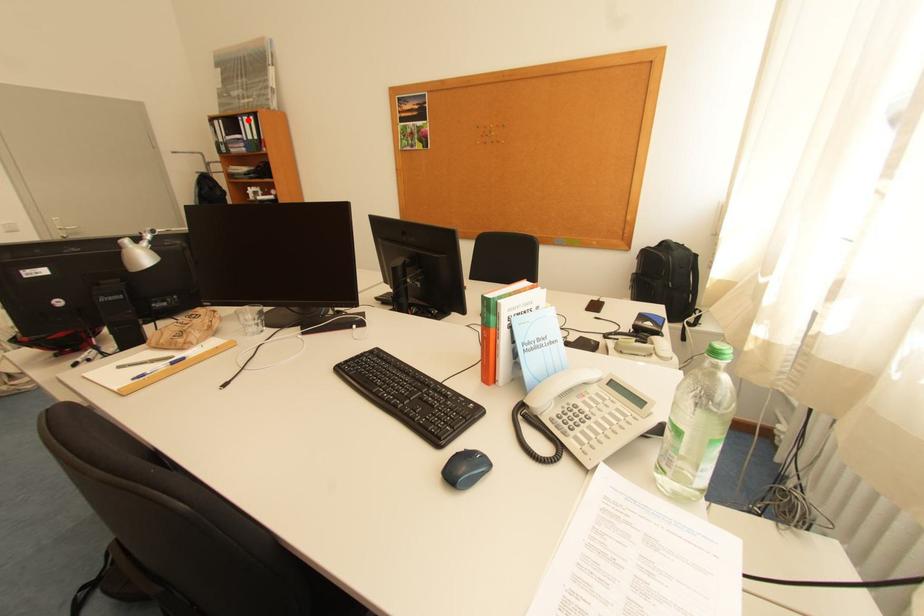
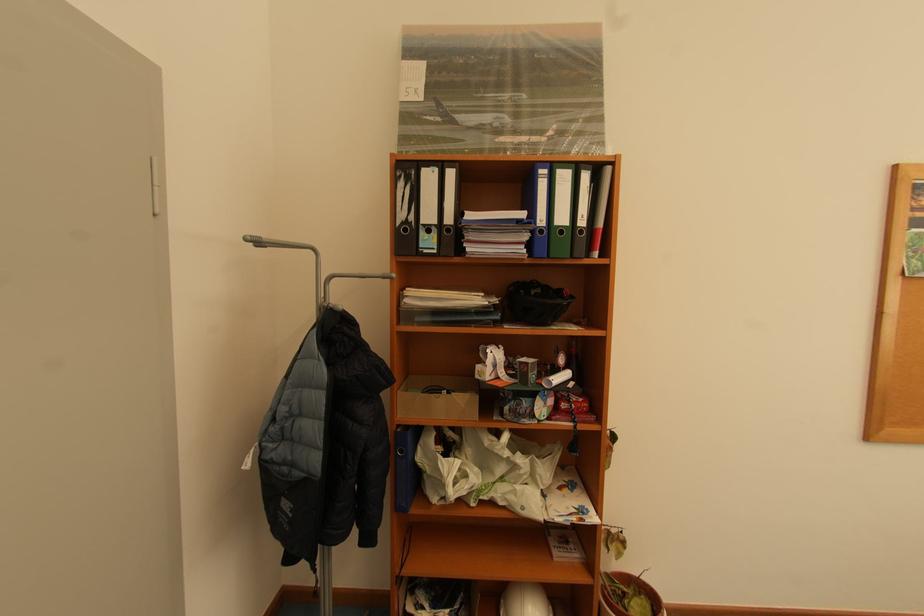
Find the pixel in the second image that matches the highlighted location in the first image.

(552, 172)